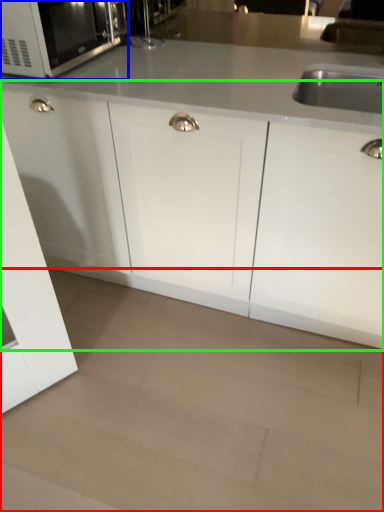
Question: Considering the real-world distances, which object is farthest from granite (highlighted by a red box)? microwave oven (highlighted by a blue box) or cabinetry (highlighted by a green box)?

Choices:
 (A) microwave oven
 (B) cabinetry

Answer: (A)